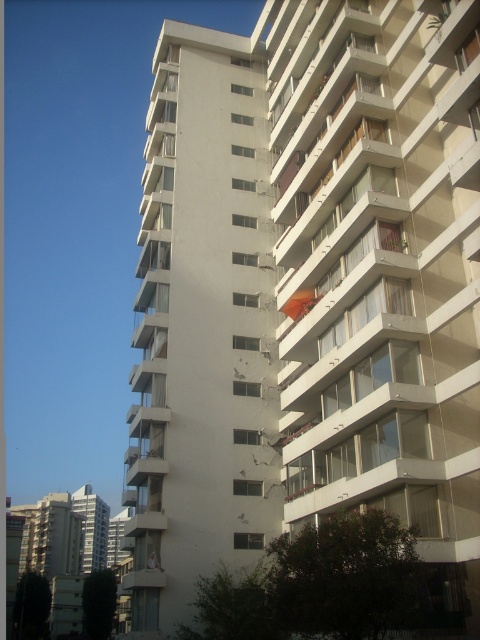
You are standing on the sidewalk in front of the residential building. You see the white glossy balcony at center and the orange fabric umbrella at center. Which object is higher from the ground?

The white glossy balcony at center is above the orange fabric umbrella at center, so the white glossy balcony at center is higher from the ground.

You are standing on the ground floor of the residential building and want to place a new large potted plant on the balcony. Which object, the white glossy balcony at center or the orange fabric umbrella at center, can accommodate the plant better based on their sizes?

The white glossy balcony at center has a larger size compared to the orange fabric umbrella at center, so it can accommodate the large potted plant better.